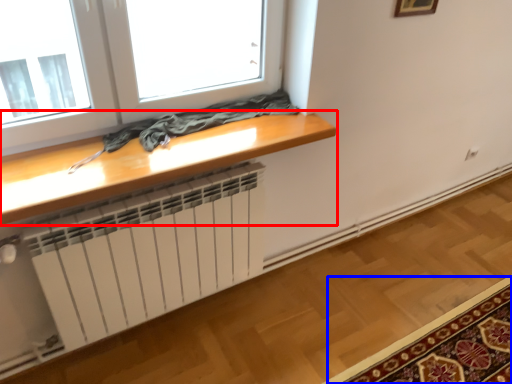
Question: Which point is closer to the camera, table (highlighted by a red box) or mat (highlighted by a blue box)?

Choices:
 (A) table
 (B) mat

Answer: (A)